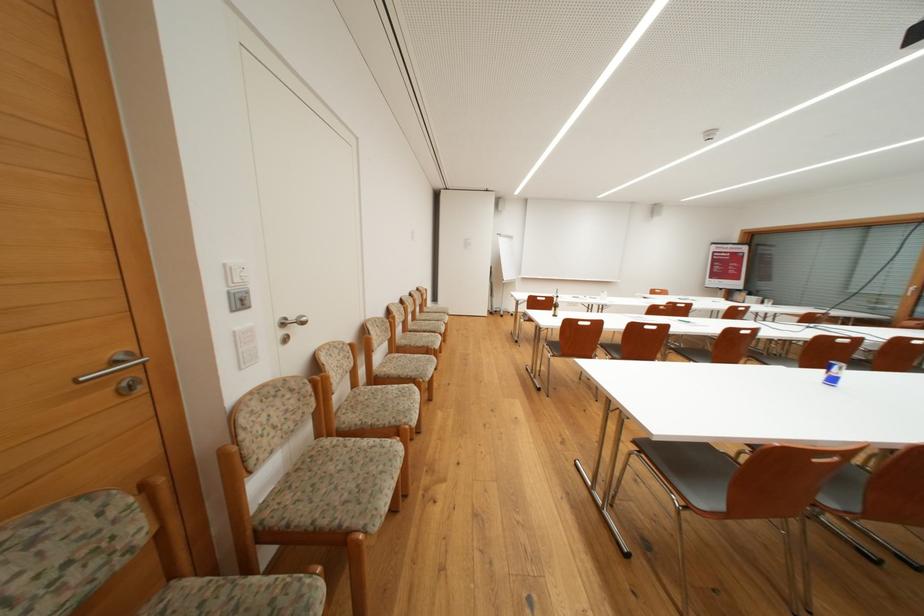
Where would you push the white light switch? Please return your answer as a coordinate pair (x, y).

(246, 346)